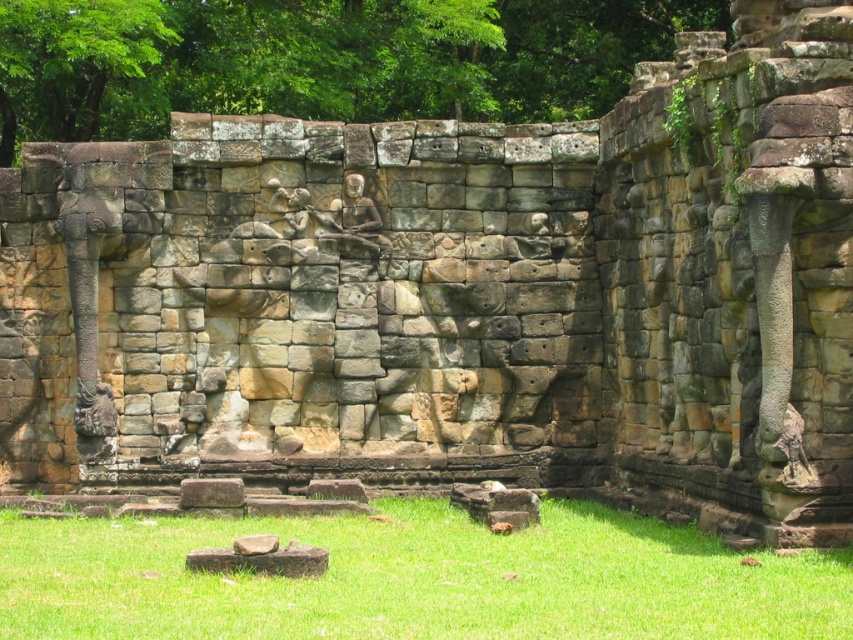
Does green grass at lower center have a lesser width compared to brown stone elephant at left?

Incorrect, green grass at lower center's width is not less than brown stone elephant at left's.

Can you confirm if green grass at lower center is bigger than brown stone elephant at left?

Actually, green grass at lower center might be smaller than brown stone elephant at left.

Which is in front, point (624, 588) or point (100, 150)?

Point (624, 588) is more forward.

What are the coordinates of `green grass at lower center` in the screenshot? It's located at click(x=415, y=579).

Does brown stone elephant at left appear on the right side of rustic stone carving at center?

Incorrect, brown stone elephant at left is not on the right side of rustic stone carving at center.

Locate an element on the screen. brown stone elephant at left is located at coordinates (97, 237).

The height and width of the screenshot is (640, 853). Identify the location of brown stone elephant at left. (97, 237).

Can you confirm if green grass at lower center is wider than rustic stone carving at center?

Correct, the width of green grass at lower center exceeds that of rustic stone carving at center.

Can you confirm if green grass at lower center is positioned to the right of rustic stone carving at center?

Correct, you'll find green grass at lower center to the right of rustic stone carving at center.

Which is in front, point (0, 618) or point (180, 282)?

Point (0, 618) is more forward.

The width and height of the screenshot is (853, 640). What are the coordinates of `green grass at lower center` in the screenshot? It's located at (415, 579).